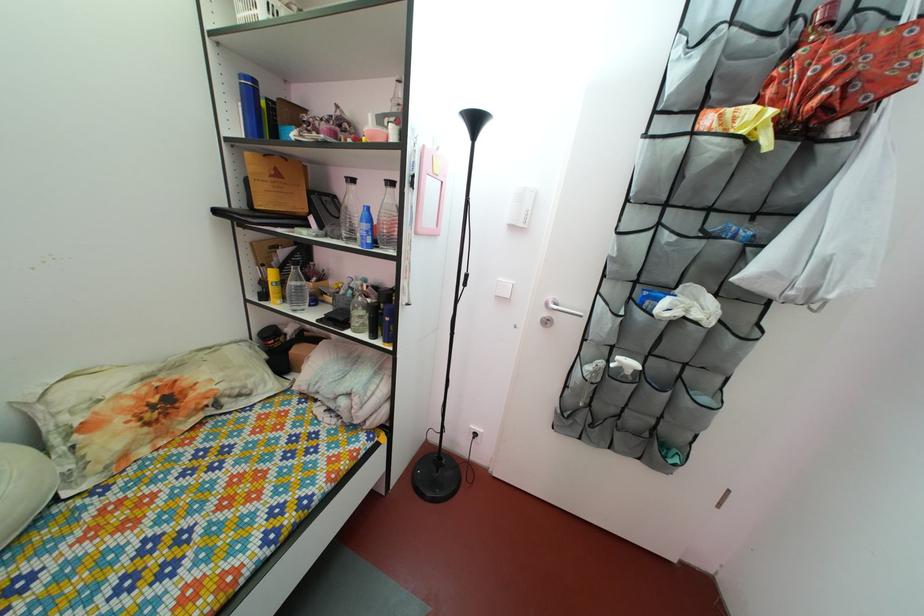
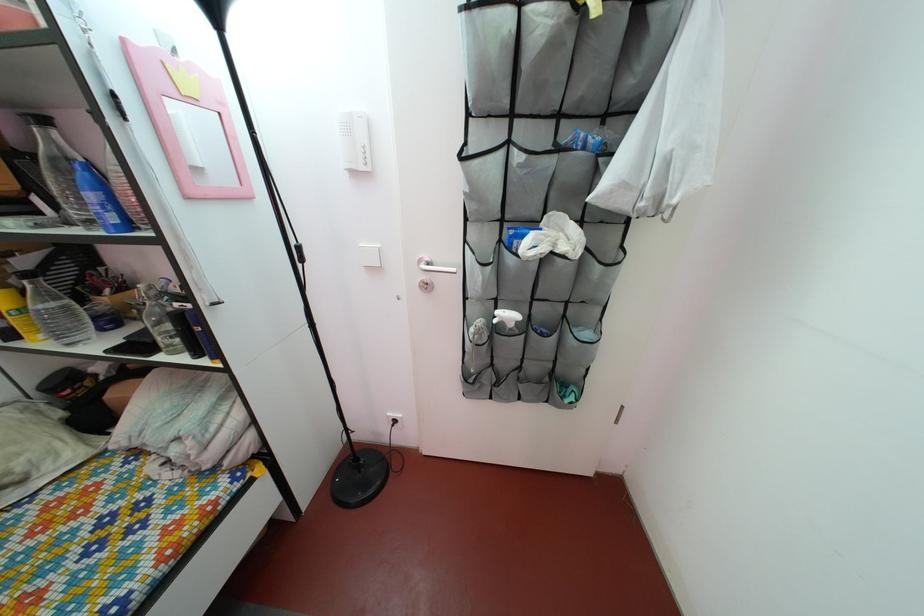
Locate, in the second image, the point that corresponds to point (282, 299) in the first image.

(27, 330)